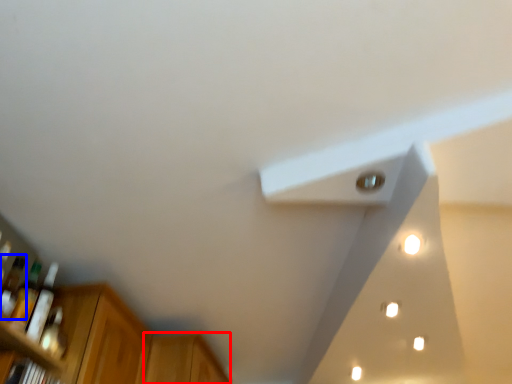
Question: Which object appears farthest to the camera in this image, cabinetry (highlighted by a red box) or bottle (highlighted by a blue box)?

Choices:
 (A) cabinetry
 (B) bottle

Answer: (A)